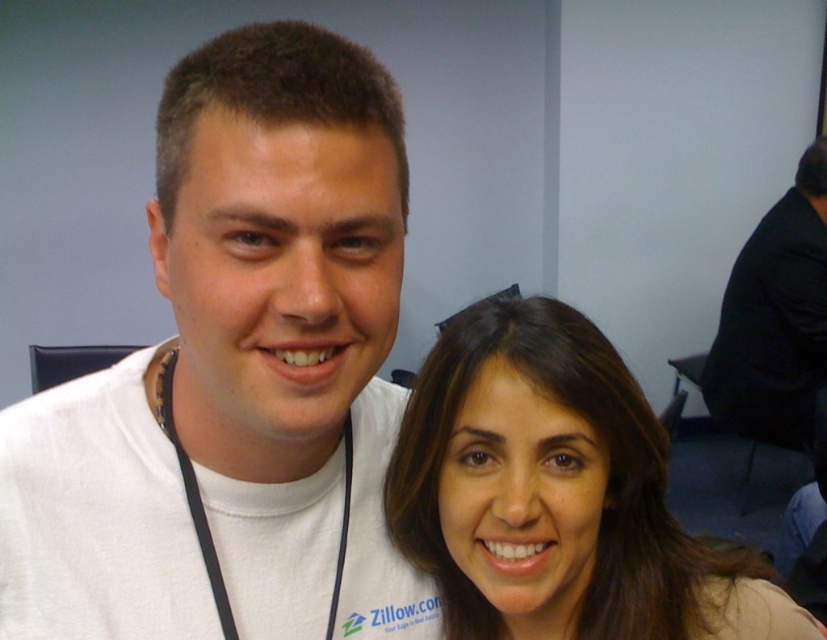
Question: Which point is farther from the camera taking this photo?

Choices:
 (A) (417, 531)
 (B) (787, 356)

Answer: (B)

Question: Can you confirm if brown hair at center is smaller than black fabric shirt at right?

Choices:
 (A) yes
 (B) no

Answer: (A)

Question: Which point is farther to the camera?

Choices:
 (A) brown hair at center
 (B) black fabric shirt at right

Answer: (B)

Question: Can you confirm if brown hair at center is positioned to the right of black fabric shirt at right?

Choices:
 (A) yes
 (B) no

Answer: (B)

Question: Is brown hair at center positioned in front of black fabric shirt at right?

Choices:
 (A) no
 (B) yes

Answer: (B)